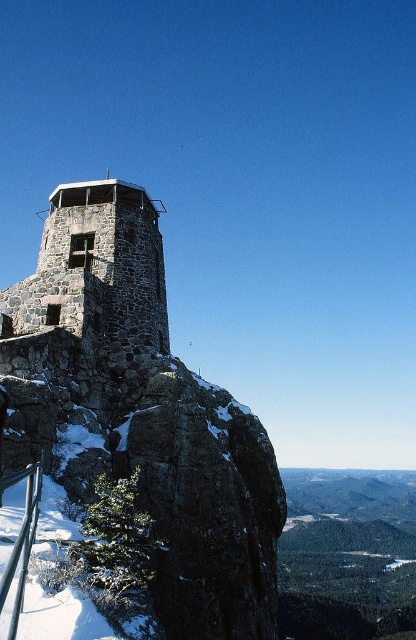
Is rustic stone tower at center below metal/rustic rail at lower left?

Actually, rustic stone tower at center is above metal/rustic rail at lower left.

Is rustic stone tower at center shorter than metal/rustic rail at lower left?

In fact, rustic stone tower at center may be taller than metal/rustic rail at lower left.

Which is in front, point (128, 250) or point (29, 483)?

Positioned in front is point (29, 483).

Identify the location of rustic stone tower at center. (96, 268).

Between point (62, 477) and point (12, 612), which one is positioned behind?

Point (62, 477)

Which of these two, stone tower at center or metal/rustic rail at lower left, stands taller?

stone tower at center is taller.

This screenshot has height=640, width=416. I want to click on stone tower at center, so click(x=140, y=412).

Is stone tower at center above rustic stone tower at center?

Actually, stone tower at center is below rustic stone tower at center.

Which is in front, point (101, 204) or point (88, 189)?

Point (101, 204)

I want to click on stone tower at center, so (140, 412).

What are the coordinates of `stone tower at center` in the screenshot? It's located at (140, 412).